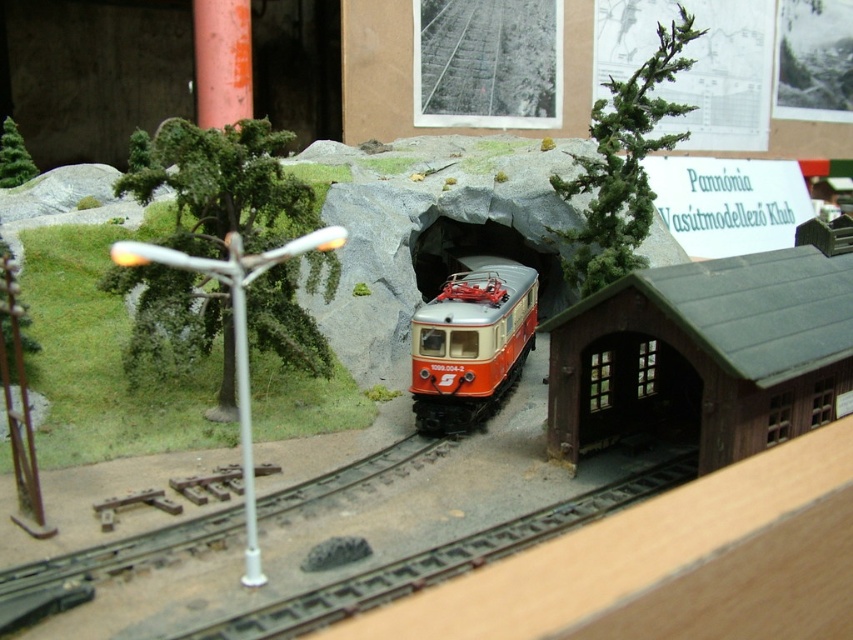
Is green textured tree at upper center thinner than smooth metal train track at center?

Yes, green textured tree at upper center is thinner than smooth metal train track at center.

Between green textured tree at upper center and smooth metal train track at center, which one is positioned lower?

Positioned lower is smooth metal train track at center.

Measure the distance between point (606, 157) and camera.

They are 6.17 meters apart.

The width and height of the screenshot is (853, 640). I want to click on green textured tree at upper center, so click(x=622, y=164).

Between point (306, 611) and point (22, 572), which one is positioned in front?

Point (306, 611) is more forward.

Based on the photo, does brown metal train track at lower center lie in front of smooth metal train track at center?

No.

Where is `brown metal train track at lower center`? brown metal train track at lower center is located at coordinates (444, 557).

Locate an element on the screen. Image resolution: width=853 pixels, height=640 pixels. brown metal train track at lower center is located at coordinates (444, 557).

Is the position of smooth metal train track at center less distant than that of green textured pine tree at upper left?

That is True.

Can you confirm if smooth metal train track at center is shorter than green textured pine tree at upper left?

Indeed, smooth metal train track at center has a lesser height compared to green textured pine tree at upper left.

What do you see at coordinates (115, 554) in the screenshot?
I see `smooth metal train track at center` at bounding box center [115, 554].

The height and width of the screenshot is (640, 853). Identify the location of smooth metal train track at center. (115, 554).